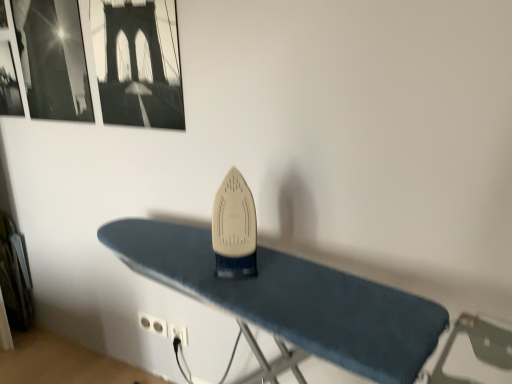
You are a GUI agent. You are given a task and a screenshot of the screen. Output one action in this format:
    pyautogui.click(x=<x>, y=<y>)
    Task: Click on the free region on the left part of white plastic iron at center
    This screenshot has height=384, width=512.
    Given the screenshot: What is the action you would take?
    pyautogui.click(x=182, y=264)